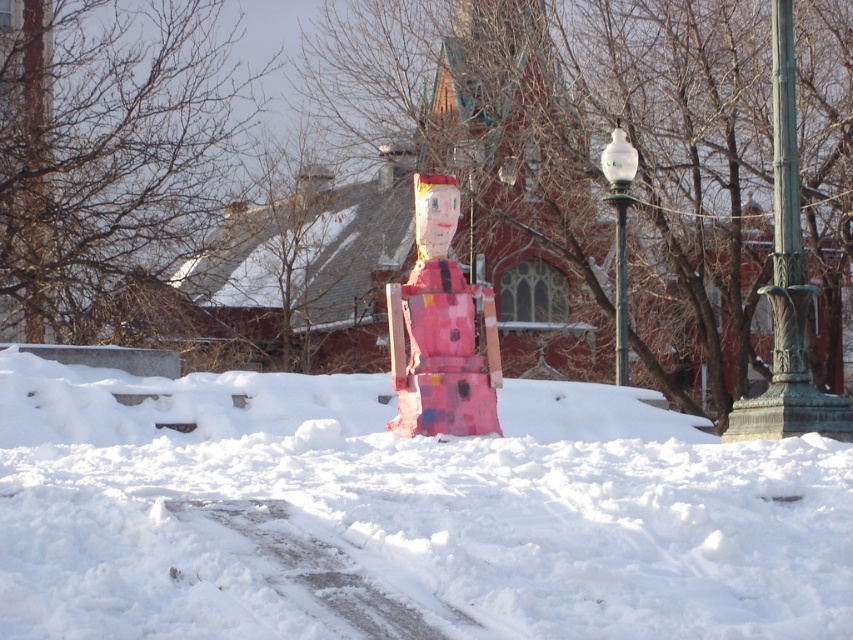
Question: Which point appears farthest from the camera in this image?

Choices:
 (A) (616, 246)
 (B) (432, 250)
 (C) (364, 563)
 (D) (616, 225)

Answer: (D)

Question: Is painted cardboard figure at center wider than white glass lamp post at upper right?

Choices:
 (A) no
 (B) yes

Answer: (B)

Question: Which of the following is the closest to the observer?

Choices:
 (A) (618, 132)
 (B) (440, 627)
 (C) (447, 412)
 (D) (627, 349)

Answer: (B)

Question: Does white fluffy snow at center appear over metallic green pole at center-right?

Choices:
 (A) yes
 (B) no

Answer: (B)

Question: Which of these objects is positioned farthest from the painted cardboard figure at center?

Choices:
 (A) white fluffy snow at center
 (B) white glass lamp post at upper right

Answer: (B)

Question: Does white glass lamp post at upper right appear on the right side of metallic green pole at center-right?

Choices:
 (A) yes
 (B) no

Answer: (B)